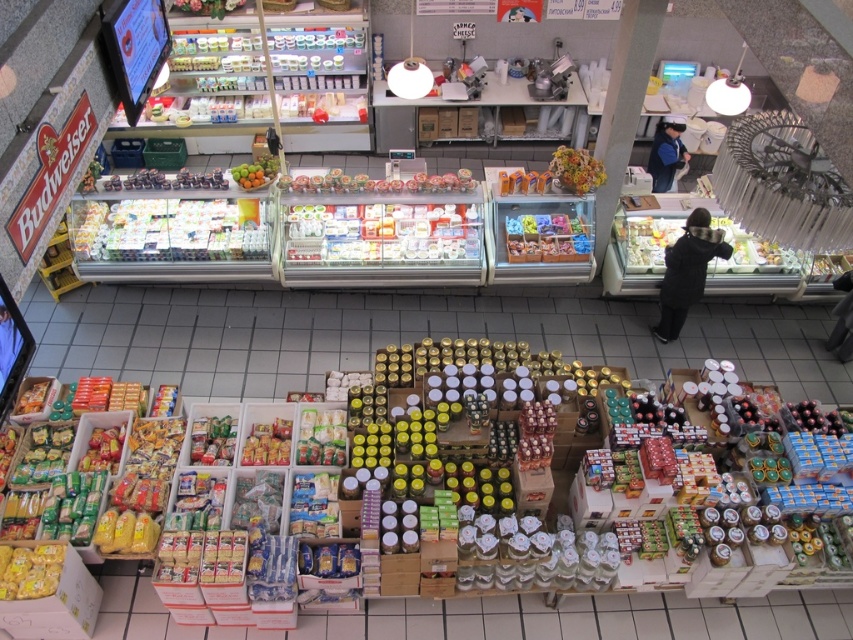
You are a customer in the store and want to place a small gift on the counter. You have a black woolen jacket at center and a multicolored floral arrangement at center. Which item would you choose to ensure it fits comfortably on the counter without overcrowding?

The multicolored floral arrangement at center is smaller in size than the black woolen jacket at center, so it would fit better on the counter without overcrowding.

You are standing in the grocery store and want to locate the black woolen jacket at center. According to the store layout, where exactly would you find it?

The black woolen jacket at center is located at point [686,272] in the store layout.

You are standing in the grocery store and want to pick up an item located at point (575, 188) and another item at point (253, 172). Which item should you pick up first if you want to start with the one closer to you?

You should pick up the item at point (253, 172) first because it is closer to you than the item at point (575, 188), which is further away.